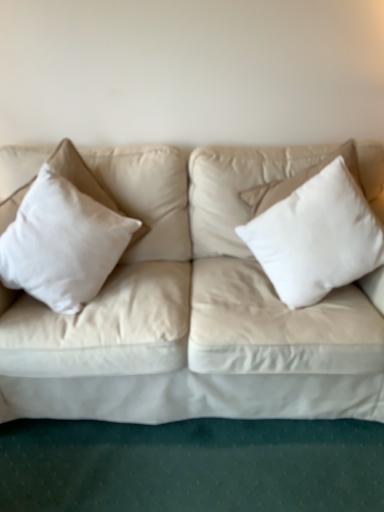
Question: From the image's perspective, relative to white cotton pillow at left, acting as the 2th pillow starting from the right, is white soft pillow at right, positioned as the 2th pillow in left-to-right order, above or below?

Choices:
 (A) above
 (B) below

Answer: (A)

Question: From a real-world perspective, relative to white cotton pillow at left, which ranks as the first pillow in left-to-right order, is white soft pillow at right, positioned as the 2th pillow in left-to-right order, vertically above or below?

Choices:
 (A) above
 (B) below

Answer: (A)

Question: In the image, is white soft pillow at right, placed as the 1th pillow when sorted from right to left, on the left side or the right side of white cotton pillow at left, which ranks as the first pillow in left-to-right order?

Choices:
 (A) right
 (B) left

Answer: (A)

Question: Considering the positions of white cotton pillow at left, acting as the 2th pillow starting from the right, and white soft pillow at right, placed as the 1th pillow when sorted from right to left, in the image, is white cotton pillow at left, acting as the 2th pillow starting from the right, bigger or smaller than white soft pillow at right, placed as the 1th pillow when sorted from right to left,?

Choices:
 (A) small
 (B) big

Answer: (A)

Question: Do you think white cotton pillow at left, which ranks as the first pillow in left-to-right order, is within white soft pillow at right, placed as the 1th pillow when sorted from right to left, or outside of it?

Choices:
 (A) outside
 (B) inside

Answer: (A)

Question: Is point (46, 189) closer or farther from the camera than point (352, 188)?

Choices:
 (A) closer
 (B) farther

Answer: (B)

Question: Is white cotton pillow at left, acting as the 2th pillow starting from the right, in front of or behind white soft pillow at right, placed as the 1th pillow when sorted from right to left, in the image?

Choices:
 (A) behind
 (B) front

Answer: (B)